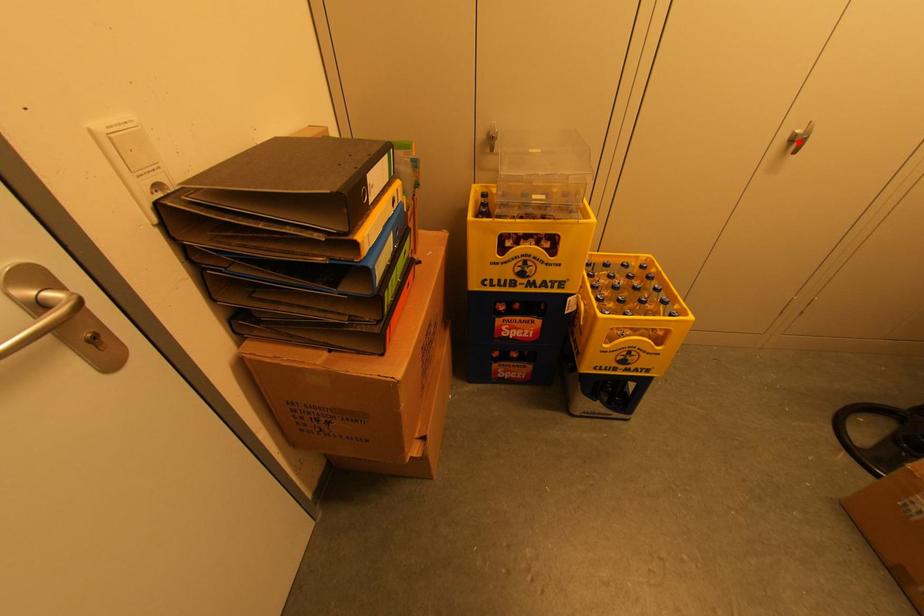
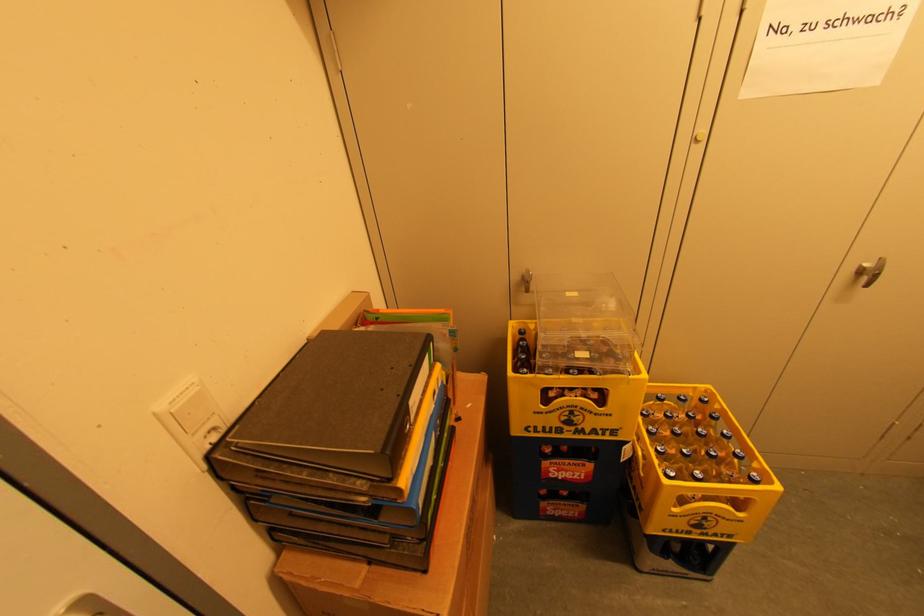
Locate, in the second image, the point that corresponds to the highlighted location in the first image.

(869, 275)